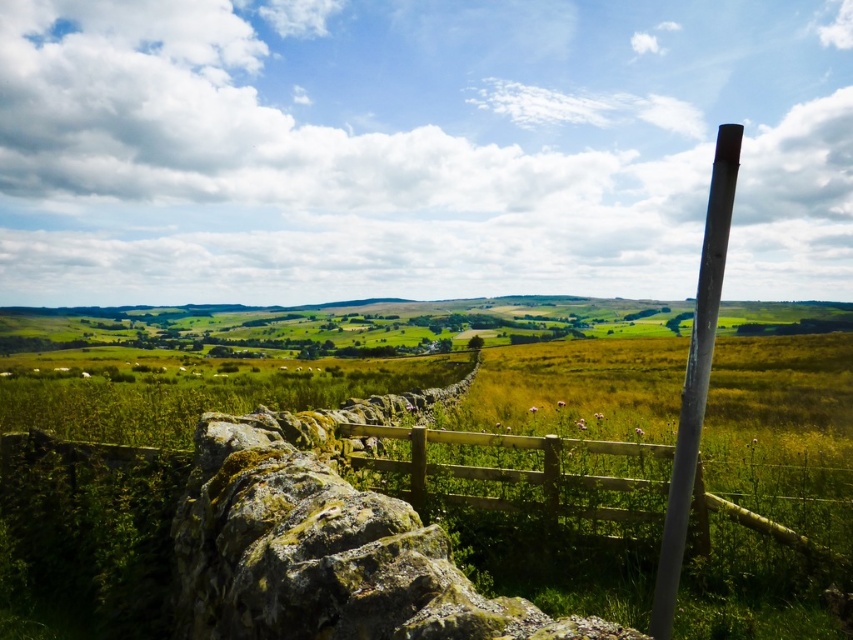
Is wooden fence at center taller than white glossy pole at right?

Incorrect, wooden fence at center's height is not larger of white glossy pole at right's.

Does point (775, 525) come closer to viewer compared to point (662, 616)?

No, (775, 525) is behind (662, 616).

Identify the location of wooden fence at center. (521, 476).

Locate an element on the screen. wooden fence at center is located at coordinates (521, 476).